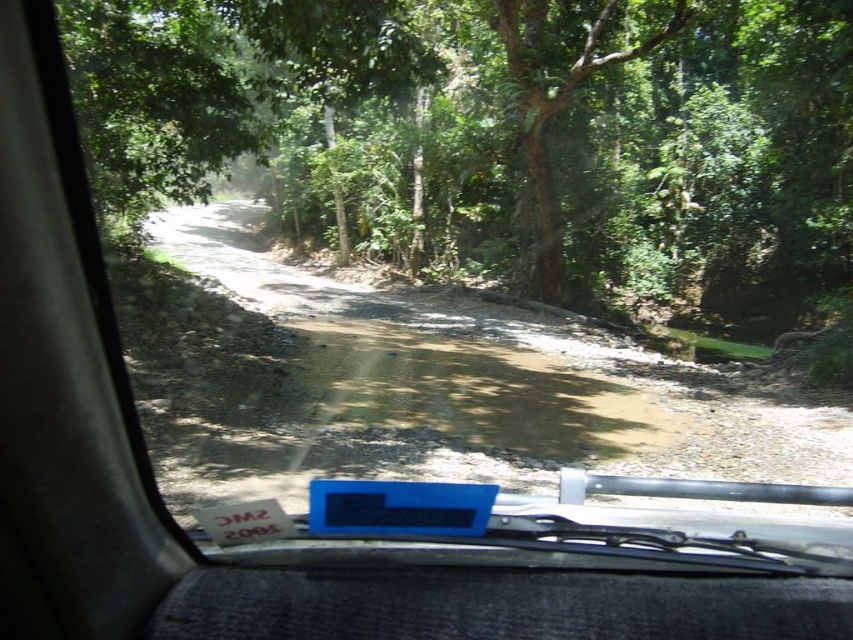
Question: Is green leafy tree at center above brown gravel dirt track at center?

Choices:
 (A) yes
 (B) no

Answer: (A)

Question: Where is green leafy tree at center located in relation to brown gravel dirt track at center in the image?

Choices:
 (A) below
 (B) above

Answer: (B)

Question: Can you confirm if green leafy tree at center is wider than brown gravel dirt track at center?

Choices:
 (A) no
 (B) yes

Answer: (B)

Question: Which point is closer to the camera taking this photo?

Choices:
 (A) (563, 449)
 (B) (251, 90)

Answer: (A)